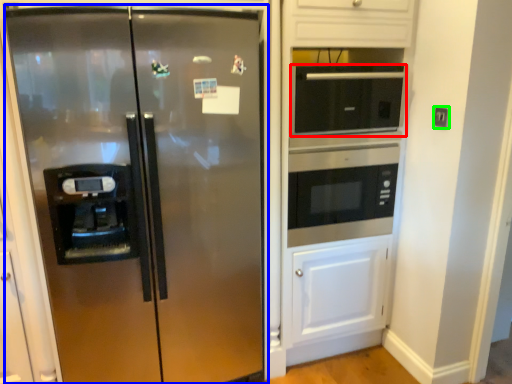
Question: Which object is positioned closest to microwave oven (highlighted by a red box)? Select from refrigerator (highlighted by a blue box) and electric outlet (highlighted by a green box).

Choices:
 (A) refrigerator
 (B) electric outlet

Answer: (B)